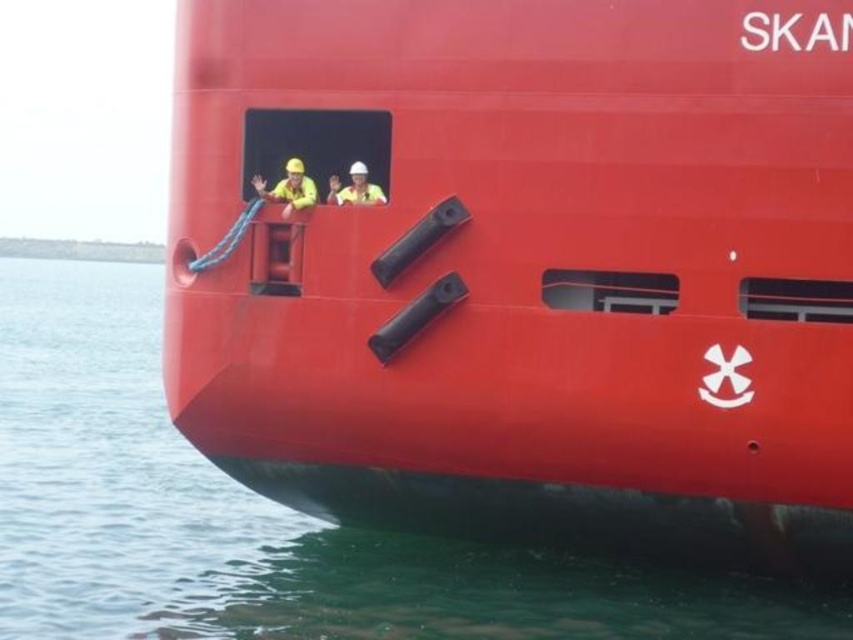
Is smooth red ship at center shorter than green water at lower left?

Correct, smooth red ship at center is not as tall as green water at lower left.

Is smooth red ship at center to the left of green water at lower left from the viewer's perspective?

No, smooth red ship at center is not to the left of green water at lower left.

Who is more forward, (177,150) or (187,624)?

Point (187,624) is in front.

What are the coordinates of `smooth red ship at center` in the screenshot? It's located at (526, 268).